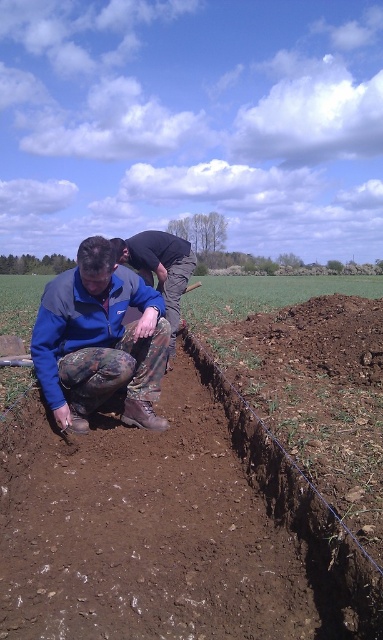
You are planning to plant a row of flowers in the trench with brown soil at center and wearing blue camouflage pants at center. Which object in the scene takes up more space?

The brown soil at center takes up more space than the blue camouflage pants at center as it is larger in size.

You are a farmer observing two workers in the field. You notice the camouflage pants at lower center and the blue camouflage pants at center. Which pair of pants is smaller in size?

The camouflage pants at lower center has a smaller size compared to the blue camouflage pants at center.

Based on the scene, can you determine which object is taller between the brown soil at center and the blue camouflage pants at center?

The brown soil at center is taller than the blue camouflage pants at center according to the description.